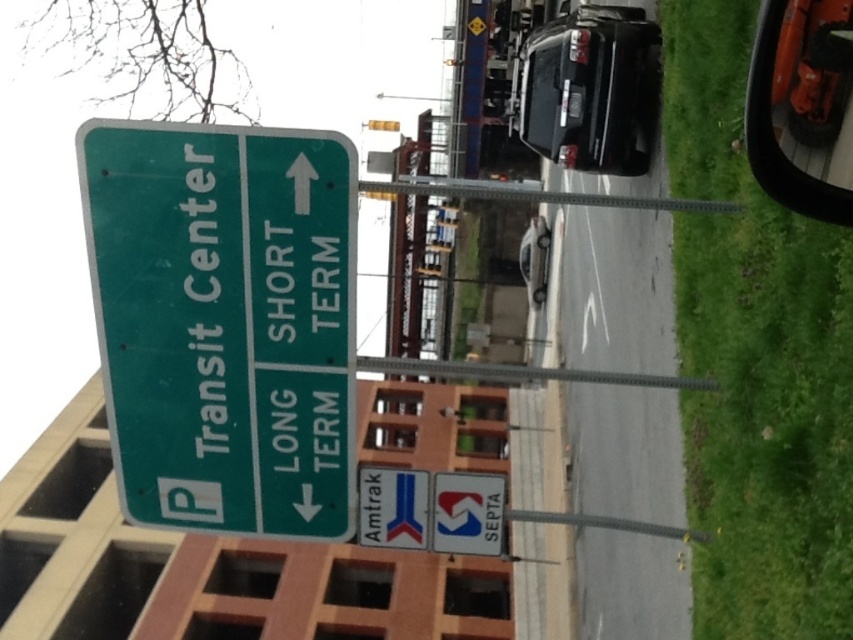
You are standing at the intersection near the Transit Center sign. There are two points marked on the ground. The first point is at coordinates point (761,6), and the second is at point (531,65). If you want to walk towards the SEPTA station entrance, which point should you approach first?

You should approach point (761,6) first because it is in front of point (531,65), meaning it is closer to your current position at the intersection.

You are a tourist trying to find the Transit Center. You see the green matte sign at upper left and the amtrak sign at upper center. Which sign should you follow to reach the Transit Center?

The green matte sign at upper left is the correct one to follow since it specifically directs towards the Transit Center, while the amtrak sign at upper center indicates the Amtrak transportation service.